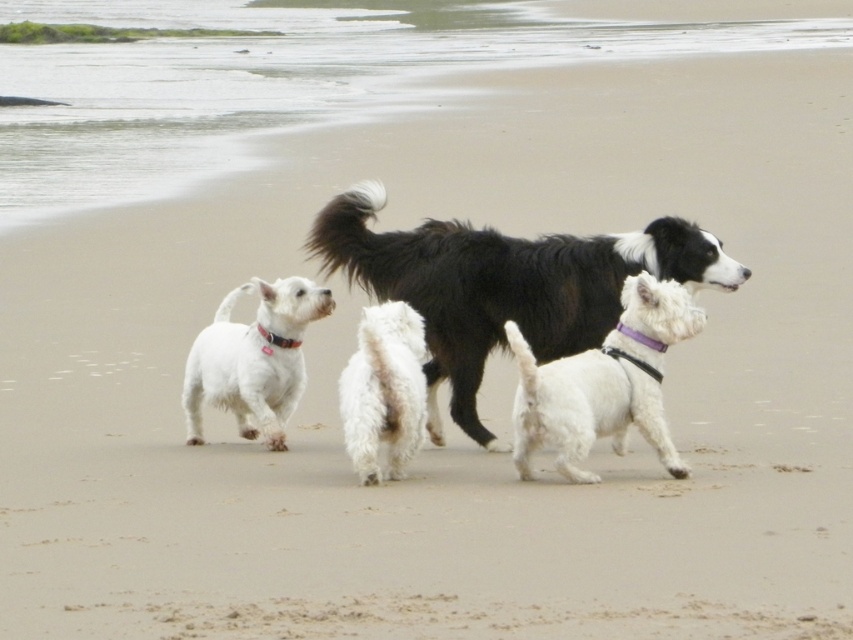
Question: Is black fluffy dog at center wider than white fluffy dog at center?

Choices:
 (A) yes
 (B) no

Answer: (A)

Question: Which point is closer to the camera?

Choices:
 (A) 686,468
 (B) 453,298
 (C) 228,388

Answer: (A)

Question: Is black fluffy dog at center behind white soft fur dog at left?

Choices:
 (A) yes
 (B) no

Answer: (B)

Question: Which of the following is the closest to the observer?

Choices:
 (A) (589, 289)
 (B) (404, 433)
 (C) (669, 465)

Answer: (B)

Question: Which object is the closest to the white soft fur dog at left?

Choices:
 (A) black fluffy dog at center
 (B) white matte dog at center
 (C) white fluffy dog at center

Answer: (A)

Question: Does white matte dog at center appear on the right side of white soft fur dog at left?

Choices:
 (A) no
 (B) yes

Answer: (B)